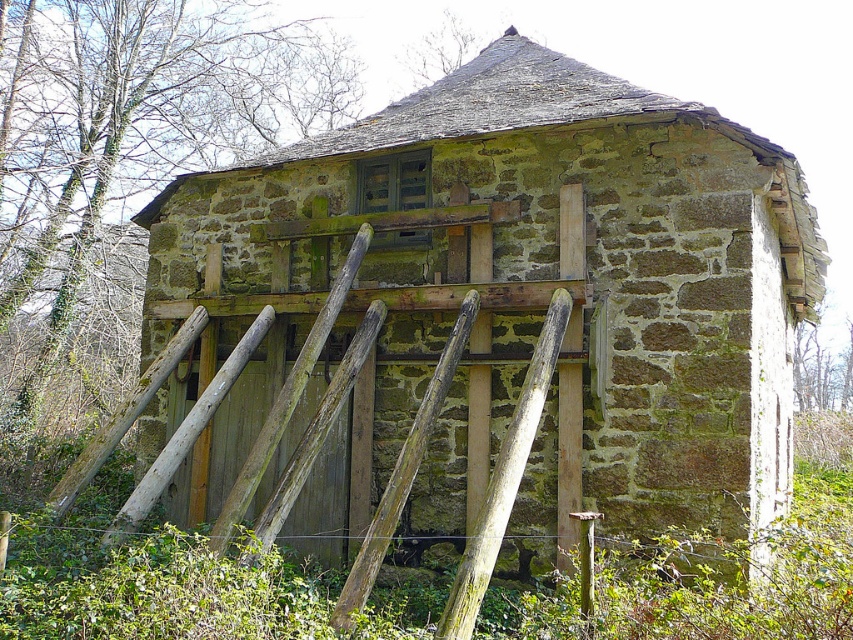
Is smooth wooden plank at center wider than weathered wood at center?

Correct, the width of smooth wooden plank at center exceeds that of weathered wood at center.

Does point (512, 432) come behind point (352, 586)?

Yes, point (512, 432) is farther from viewer.

Where is `smooth wooden plank at center`? The image size is (853, 640). smooth wooden plank at center is located at coordinates (503, 477).